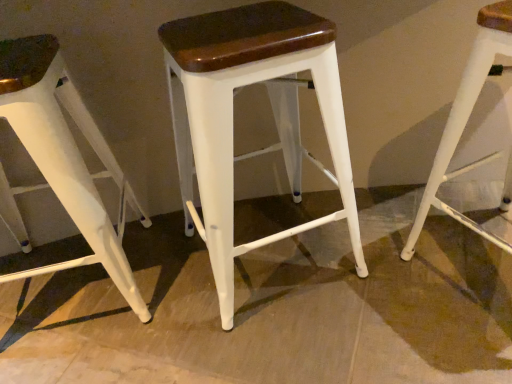
Question: Could white matte stool at center, the 2th stool from the left, be considered to be inside white matte stool at left, the 1th stool viewed from the left?

Choices:
 (A) no
 (B) yes

Answer: (A)

Question: Is the position of white matte stool at left, the 1th stool viewed from the left, more distant than that of white matte stool at center, placed as the 2th stool when sorted from right to left?

Choices:
 (A) yes
 (B) no

Answer: (A)

Question: Can you confirm if white matte stool at left, placed as the 3th stool when sorted from right to left, is positioned to the right of white matte stool at center, the 2th stool from the left?

Choices:
 (A) yes
 (B) no

Answer: (B)

Question: From the image's perspective, is white matte stool at left, the 1th stool viewed from the left, under white matte stool at center, placed as the 2th stool when sorted from right to left?

Choices:
 (A) yes
 (B) no

Answer: (A)

Question: Is the depth of white matte stool at left, the 1th stool viewed from the left, less than that of white matte stool at center, placed as the 2th stool when sorted from right to left?

Choices:
 (A) yes
 (B) no

Answer: (B)

Question: Is white matte stool at center, which is the 1th stool from right to left, bigger or smaller than white matte stool at left, placed as the 3th stool when sorted from right to left?

Choices:
 (A) big
 (B) small

Answer: (B)

Question: In terms of height, does white matte stool at center, which is the 3th stool in left-to-right order, look taller or shorter compared to white matte stool at left, the 1th stool viewed from the left?

Choices:
 (A) short
 (B) tall

Answer: (A)

Question: Considering the positions of point (479, 34) and point (34, 87), is point (479, 34) closer or farther from the camera than point (34, 87)?

Choices:
 (A) farther
 (B) closer

Answer: (A)

Question: In terms of width, does white matte stool at center, which is the 3th stool in left-to-right order, look wider or thinner when compared to white matte stool at left, the 1th stool viewed from the left?

Choices:
 (A) wide
 (B) thin

Answer: (B)

Question: Considering the positions of point (449, 205) and point (298, 183), is point (449, 205) closer or farther from the camera than point (298, 183)?

Choices:
 (A) farther
 (B) closer

Answer: (B)

Question: Visually, is white matte stool at center, which is the 1th stool from right to left, positioned to the left or to the right of white matte stool at center, placed as the 2th stool when sorted from right to left?

Choices:
 (A) left
 (B) right

Answer: (B)

Question: From a real-world perspective, relative to white matte stool at center, placed as the 2th stool when sorted from right to left, is white matte stool at center, which is the 3th stool in left-to-right order, vertically above or below?

Choices:
 (A) below
 (B) above

Answer: (B)

Question: In terms of width, does white matte stool at center, which is the 1th stool from right to left, look wider or thinner when compared to white matte stool at center, placed as the 2th stool when sorted from right to left?

Choices:
 (A) thin
 (B) wide

Answer: (A)

Question: In terms of width, does white matte stool at left, the 1th stool viewed from the left, look wider or thinner when compared to white matte stool at center, placed as the 2th stool when sorted from right to left?

Choices:
 (A) wide
 (B) thin

Answer: (B)

Question: From their relative heights in the image, would you say white matte stool at left, the 1th stool viewed from the left, is taller or shorter than white matte stool at center, placed as the 2th stool when sorted from right to left?

Choices:
 (A) short
 (B) tall

Answer: (B)